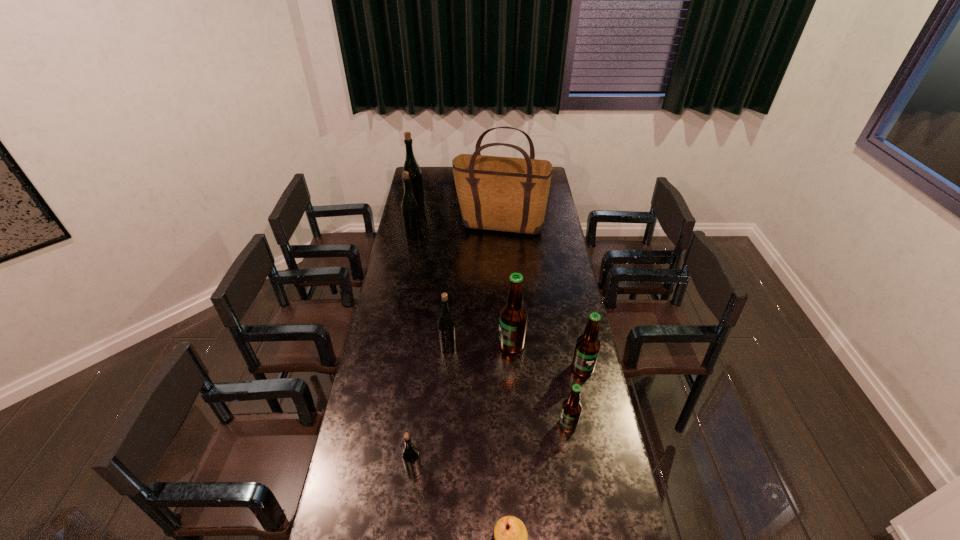
Find the location of a particular element. This screenshot has width=960, height=540. free space located 0.280m on the label of the leftmost brown beer bottle is located at coordinates (430, 345).

Find the location of `vacant space located on the front of the third farthest green beer bottle`. vacant space located on the front of the third farthest green beer bottle is located at coordinates (445, 382).

I want to click on free space located 0.050m on the label of the rightmost object, so pyautogui.click(x=587, y=389).

Locate an element on the screen. Image resolution: width=960 pixels, height=540 pixels. free space located 0.120m on the label of the second nearest beer bottle is located at coordinates (524, 425).

Locate an element on the screen. free space located on the label of the second nearest beer bottle is located at coordinates (516, 425).

Locate an element on the screen. This screenshot has height=540, width=960. blank area located 0.140m on the label of the second nearest beer bottle is located at coordinates (518, 425).

Locate an element on the screen. The width and height of the screenshot is (960, 540). vacant space located on the back of the eighth farthest object is located at coordinates (424, 378).

In order to click on tote bag that is at the right edge in this screenshot , I will do `click(507, 194)`.

In the image, there is a desktop. Where is `vacant space at the left edge`? This screenshot has height=540, width=960. vacant space at the left edge is located at coordinates (372, 382).

Where is `free space at the right edge of the desktop`? The height and width of the screenshot is (540, 960). free space at the right edge of the desktop is located at coordinates (553, 196).